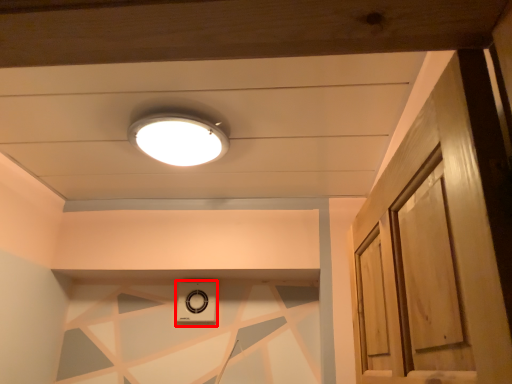
Question: In this image, where is appliance (annotated by the red box) located relative to lamp?

Choices:
 (A) right
 (B) left

Answer: (B)